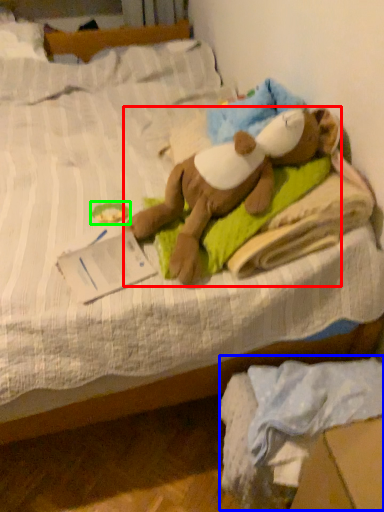
Question: Which object is positioned closest to person (highlighted by a red box)? Select from material (highlighted by a blue box) and toy (highlighted by a green box).

Choices:
 (A) material
 (B) toy

Answer: (B)